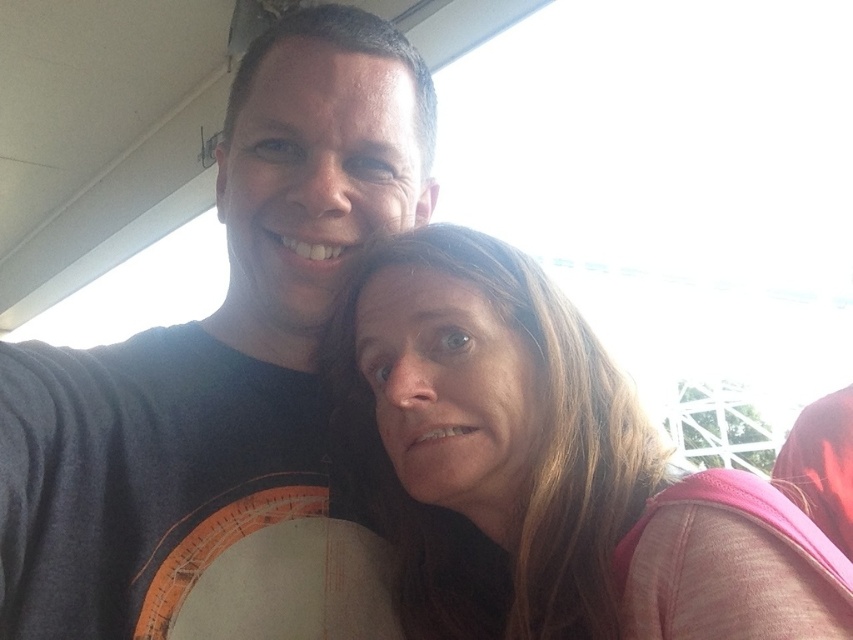
Question: Does dark gray t-shirt at upper left have a smaller size compared to pink fabric at center?

Choices:
 (A) yes
 (B) no

Answer: (B)

Question: Which of the following is the farthest from the observer?

Choices:
 (A) pink fabric at center
 (B) dark gray t-shirt at upper left

Answer: (B)

Question: Which point is farther to the camera?

Choices:
 (A) (299, 221)
 (B) (529, 390)

Answer: (A)

Question: Is the position of dark gray t-shirt at upper left less distant than that of pink fabric at center?

Choices:
 (A) yes
 (B) no

Answer: (B)

Question: In this image, where is dark gray t-shirt at upper left located relative to pink fabric at center?

Choices:
 (A) below
 (B) above

Answer: (B)